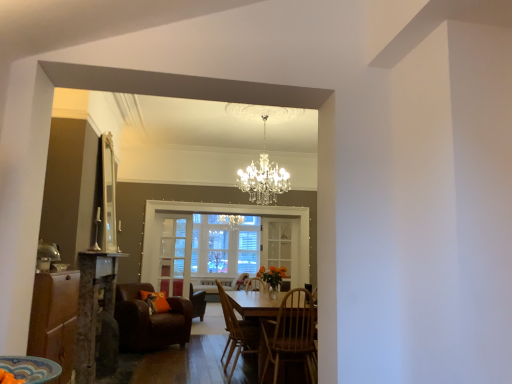
The width and height of the screenshot is (512, 384). Describe the element at coordinates (197, 302) in the screenshot. I see `brown leather chair at center, the first chair positioned from the back` at that location.

What do you see at coordinates (55, 320) in the screenshot?
I see `wooden cabinet at lower left` at bounding box center [55, 320].

In order to face clear glass door at center, placed as the 2th glass door when sorted from left to right, should I rotate leftwards or rightwards?

Turn right approximately 3.122 degrees to face it.

What is the approximate height of clear glass window at center?

clear glass window at center is 1.82 meters in height.

What do you see at coordinates (31, 368) in the screenshot? I see `translucent glass bowl at lower left` at bounding box center [31, 368].

This screenshot has width=512, height=384. Identify the location of brown leather chair at center, which appears as the 4th chair when viewed from the front. (197, 302).

Does clear glass door at center, which appears as the first glass door when viewed from the right, have a greater height compared to clear glass door at center, the first glass door from the front?

Incorrect, the height of clear glass door at center, which appears as the first glass door when viewed from the right, is not larger of that of clear glass door at center, the first glass door from the front.

Is clear glass door at center, placed as the 2th glass door when sorted from left to right, at the right side of clear glass door at center, the 1th glass door when ordered from left to right?

Yes, clear glass door at center, placed as the 2th glass door when sorted from left to right, is to the right of clear glass door at center, the 1th glass door when ordered from left to right.

You are a GUI agent. You are given a task and a screenshot of the screen. Output one action in this format:
    pyautogui.click(x=<x>, y=<y>)
    Task: Click on the glass door in front of the clear glass door at center, the second glass door from the front
    The height and width of the screenshot is (384, 512).
    Given the screenshot: What is the action you would take?
    pyautogui.click(x=174, y=255)

Which object is wider, clear glass door at center, placed as the 2th glass door when sorted from left to right, or clear glass door at center, the 1th glass door when ordered from left to right?

With larger width is clear glass door at center, placed as the 2th glass door when sorted from left to right.

From a real-world perspective, is wooden chair at center, which is the second chair from front to back, located beneath clear glass door at center, placed as the second glass door when sorted from back to front?

Correct, in the physical world, wooden chair at center, which is the second chair from front to back, is lower than clear glass door at center, placed as the second glass door when sorted from back to front.

Is point (230, 340) closer to viewer compared to point (167, 296)?

Yes, point (230, 340) is closer to viewer.

Is wooden chair at center, which is the second chair from front to back, oriented away from clear glass door at center, the 2th glass door when ordered from right to left?

No, wooden chair at center, which is the second chair from front to back, is not facing away from clear glass door at center, the 2th glass door when ordered from right to left.

Consider the image. Does clear glass door at center, the 1th glass door when ordered from left to right, have a larger size compared to brown leather chair at center, the first chair positioned from the back?

Actually, clear glass door at center, the 1th glass door when ordered from left to right, might be smaller than brown leather chair at center, the first chair positioned from the back.

How different are the orientations of clear glass door at center, the first glass door from the front, and brown leather chair at center, which appears as the 4th chair when viewed from the front, in degrees?

There is a 155-degree angle between the facing directions of clear glass door at center, the first glass door from the front, and brown leather chair at center, which appears as the 4th chair when viewed from the front.

Is clear glass door at center, the 2th glass door when ordered from right to left, spatially inside brown leather chair at center, which appears as the 4th chair when viewed from the front, or outside of it?

clear glass door at center, the 2th glass door when ordered from right to left, is not inside brown leather chair at center, which appears as the 4th chair when viewed from the front, it's outside.

Is clear glass door at center, the first glass door from the front, beside brown leather chair at center, which appears as the 4th chair when viewed from the front?

They are not placed beside each other.

Is clear glass door at center, placed as the second glass door when sorted from back to front, oriented towards wooden cabinet at lower left?

Yes, clear glass door at center, placed as the second glass door when sorted from back to front, is facing wooden cabinet at lower left.

Is clear glass door at center, the 2th glass door when ordered from right to left, surrounding wooden cabinet at lower left?

No.

Considering the sizes of objects clear glass door at center, the first glass door from the front, and wooden cabinet at lower left in the image provided, who is smaller, clear glass door at center, the first glass door from the front, or wooden cabinet at lower left?

clear glass door at center, the first glass door from the front, is smaller.

Is point (175, 270) behind point (57, 273)?

Yes, point (175, 270) is behind point (57, 273).

Is translucent glass bowl at lower left at the back of wooden cabinet at lower left?

No.

Is wooden cabinet at lower left taller or shorter than translucent glass bowl at lower left?

wooden cabinet at lower left is taller than translucent glass bowl at lower left.

Consider the image. Who is smaller, wooden cabinet at lower left or translucent glass bowl at lower left?

With smaller size is translucent glass bowl at lower left.

From the image's perspective, which one is positioned higher, wooden cabinet at lower left or translucent glass bowl at lower left?

translucent glass bowl at lower left, from the image's perspective.

Who is shorter, clear glass window at center or wooden chair at center, which ranks as the first chair in front-to-back order?

With less height is wooden chair at center, which ranks as the first chair in front-to-back order.

Who is more distant, clear glass window at center or wooden chair at center, which is the fourth chair from back to front?

clear glass window at center is more distant.

From a real-world perspective, is clear glass window at center on wooden chair at center, which ranks as the first chair in front-to-back order?

Answer: Yes.

Find the location of a particular element. window below the clear glass door at center, the 2th glass door when ordered from right to left (from a real-world perspective) is located at coordinates (222, 212).

Considering the positions of point (190, 251) and point (165, 285), is point (190, 251) closer or farther from the camera than point (165, 285)?

Point (190, 251).

Can you tell me how much clear glass window at center and clear glass door at center, the first glass door from the front, differ in facing direction?

0.368 degrees.

Is clear glass window at center to the left or to the right of clear glass door at center, placed as the second glass door when sorted from back to front, in the image?

clear glass window at center is to the right of clear glass door at center, placed as the second glass door when sorted from back to front.

Image resolution: width=512 pixels, height=384 pixels. Identify the location of glass door that is on the right side of clear glass door at center, placed as the second glass door when sorted from back to front. (281, 246).

Find the location of a particular element. chair that is the 2nd one when counting forward from the clear glass door at center, placed as the second glass door when sorted from back to front is located at coordinates (237, 332).

Based on the photo, when comparing their distances from wooden chair at center, which is the second chair from front to back, does clear glass window at center or clear glass door at center, the 1th glass door when ordered from left to right, seem further?

clear glass window at center is positioned further to the anchor wooden chair at center, which is the second chair from front to back.

Looking at the image, which one is located further to wooden cabinet at lower left, clear glass door at center, the first glass door from the front, or clear glass door at center, placed as the 2th glass door when sorted from left to right?

Based on the image, clear glass door at center, placed as the 2th glass door when sorted from left to right, appears to be further to wooden cabinet at lower left.

Considering their positions, is clear glass door at center, the 1th glass door when ordered from left to right, positioned closer to clear glass window at center than brown leather chair at center, the first chair positioned from the back?

clear glass door at center, the 1th glass door when ordered from left to right.

Based on their spatial positions, is wooden cabinet at lower left or clear glass door at center, the 2th glass door when ordered from right to left, further from wooden chair at center, which ranks as the first chair in front-to-back order?

clear glass door at center, the 2th glass door when ordered from right to left.

Looking at the image, which one is located further to wooden cabinet at lower left, clear glass window at center or clear glass door at center, the 2th glass door when ordered from right to left?

The object further to wooden cabinet at lower left is clear glass window at center.

Considering their positions, is clear glass door at center, the first glass door from the front, positioned closer to clear glass door at center, positioned as the 1th glass door in back-to-front order, than brown leather chair at center, which appears as the 4th chair when viewed from the front?

The object closer to clear glass door at center, positioned as the 1th glass door in back-to-front order, is brown leather chair at center, which appears as the 4th chair when viewed from the front.

From the image, which object appears to be nearer to clear glass door at center, the first glass door from the front, wooden chair at center, which is the second chair from front to back, or leather armchair at lower left, which appears as the second chair when viewed from the back?

The object closer to clear glass door at center, the first glass door from the front, is leather armchair at lower left, which appears as the second chair when viewed from the back.

When comparing their distances from wooden cabinet at lower left, does brown leather chair at center, which appears as the 4th chair when viewed from the front, or wooden chair at center, the 3th chair from the back, seem closer?

wooden chair at center, the 3th chair from the back, lies closer to wooden cabinet at lower left than the other object.

The image size is (512, 384). I want to click on window between wooden chair at center, the 3th chair from the back, and clear glass door at center, the 2th glass door when ordered from right to left, from front to back, so click(222, 212).

Image resolution: width=512 pixels, height=384 pixels. Find the location of `glass door situated between leather armchair at lower left, the 3th chair when ordered from front to back, and clear glass door at center, placed as the 2th glass door when sorted from left to right, from left to right`. glass door situated between leather armchair at lower left, the 3th chair when ordered from front to back, and clear glass door at center, placed as the 2th glass door when sorted from left to right, from left to right is located at coordinates 174,255.

Locate an element on the screen. The height and width of the screenshot is (384, 512). glass door located between brown leather chair at center, the first chair positioned from the back, and clear glass window at center in the left-right direction is located at coordinates (174, 255).

Where is `window between leather armchair at lower left, which appears as the second chair when viewed from the back, and clear glass door at center, the 2th glass door when ordered from right to left, in the front-back direction`? Image resolution: width=512 pixels, height=384 pixels. window between leather armchair at lower left, which appears as the second chair when viewed from the back, and clear glass door at center, the 2th glass door when ordered from right to left, in the front-back direction is located at coordinates 222,212.